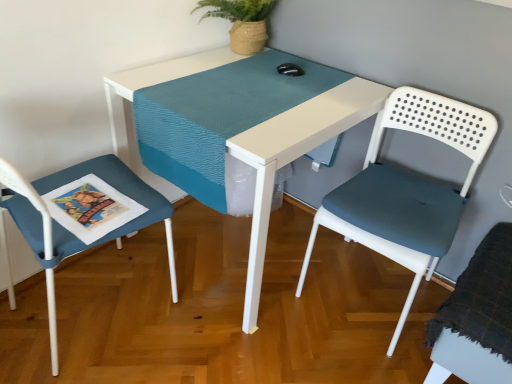
Question: Considering the relative sizes of teal woven runner at center and white plastic chair at right, which appears as the second chair when viewed from the right, in the image provided, is teal woven runner at center wider than white plastic chair at right, which appears as the second chair when viewed from the right,?

Choices:
 (A) yes
 (B) no

Answer: (A)

Question: Can you confirm if teal woven runner at center is positioned to the right of white plastic chair at right, which appears as the second chair when viewed from the right?

Choices:
 (A) yes
 (B) no

Answer: (B)

Question: Is teal woven runner at center outside white plastic chair at right, which appears as the second chair when viewed from the right?

Choices:
 (A) no
 (B) yes

Answer: (B)

Question: Can you confirm if teal woven runner at center is positioned to the left of white plastic chair at right, which appears as the 2th chair when viewed from the left?

Choices:
 (A) yes
 (B) no

Answer: (A)

Question: Can you confirm if teal woven runner at center is thinner than white plastic chair at right, which appears as the 2th chair when viewed from the left?

Choices:
 (A) yes
 (B) no

Answer: (B)

Question: Is textured blue cushion at left, arranged as the 1th chair when viewed from the left, in front of or behind teal woven runner at center in the image?

Choices:
 (A) front
 (B) behind

Answer: (A)

Question: Based on their positions, is textured blue cushion at left, arranged as the 1th chair when viewed from the left, located to the left or right of teal woven runner at center?

Choices:
 (A) right
 (B) left

Answer: (B)

Question: Based on their sizes in the image, would you say textured blue cushion at left, which is the third chair from right to left, is bigger or smaller than teal woven runner at center?

Choices:
 (A) big
 (B) small

Answer: (A)

Question: From a real-world perspective, is textured blue cushion at left, which is the third chair from right to left, physically located above or below teal woven runner at center?

Choices:
 (A) above
 (B) below

Answer: (B)

Question: Is teal woven runner at center bigger or smaller than white plastic chair at right, which appears as the 2th chair when viewed from the left?

Choices:
 (A) big
 (B) small

Answer: (B)

Question: In the image, is teal woven runner at center on the left side or the right side of white plastic chair at right, which appears as the 2th chair when viewed from the left?

Choices:
 (A) left
 (B) right

Answer: (A)

Question: Considering the positions of teal woven runner at center and white plastic chair at right, which appears as the second chair when viewed from the right, in the image, is teal woven runner at center wider or thinner than white plastic chair at right, which appears as the second chair when viewed from the right,?

Choices:
 (A) wide
 (B) thin

Answer: (A)

Question: Does point (147, 100) appear closer or farther from the camera than point (400, 196)?

Choices:
 (A) closer
 (B) farther

Answer: (A)

Question: Visually, is white plastic table at center positioned to the left or to the right of white plastic chair at right, which appears as the second chair when viewed from the right?

Choices:
 (A) right
 (B) left

Answer: (B)

Question: Considering the positions of white plastic table at center and white plastic chair at right, which appears as the second chair when viewed from the right, in the image, is white plastic table at center wider or thinner than white plastic chair at right, which appears as the second chair when viewed from the right,?

Choices:
 (A) thin
 (B) wide

Answer: (B)